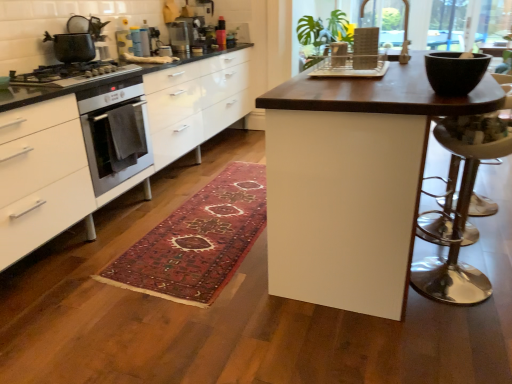
Find the location of a particular element. The width and height of the screenshot is (512, 384). vacant area that is in front of polished silver bar stool at right is located at coordinates coord(465,332).